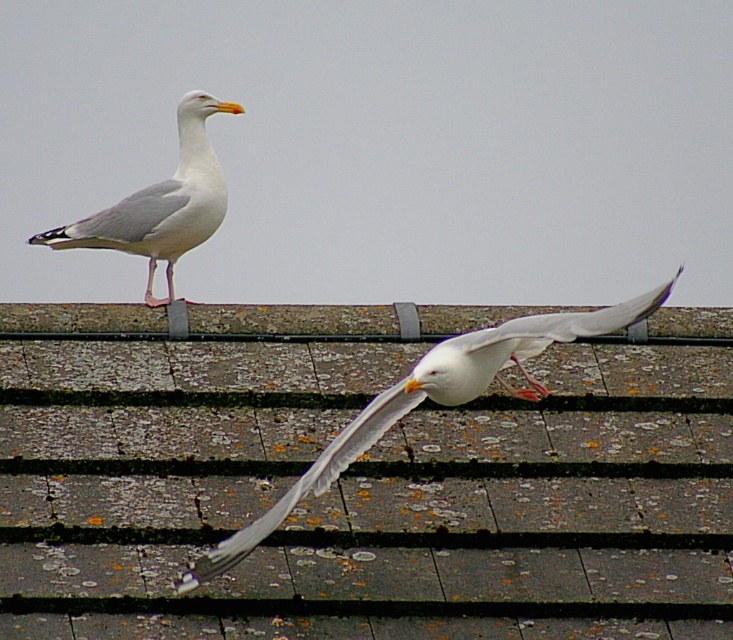
Question: Among these objects, which one is farthest from the camera?

Choices:
 (A) white feathered seagull at upper left
 (B) white feathered bird at center

Answer: (A)

Question: Is white feathered bird at center positioned behind white feathered seagull at upper left?

Choices:
 (A) no
 (B) yes

Answer: (A)

Question: Is white feathered bird at center below white feathered seagull at upper left?

Choices:
 (A) yes
 (B) no

Answer: (A)

Question: Which of the following is the farthest from the observer?

Choices:
 (A) white feathered bird at center
 (B) white feathered seagull at upper left

Answer: (B)

Question: Does white feathered bird at center lie in front of white feathered seagull at upper left?

Choices:
 (A) no
 (B) yes

Answer: (B)